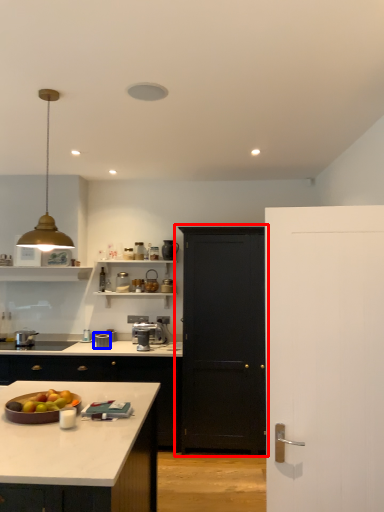
Question: Which object appears farthest to the camera in this image, door (highlighted by a red box) or appliance (highlighted by a blue box)?

Choices:
 (A) door
 (B) appliance

Answer: (B)